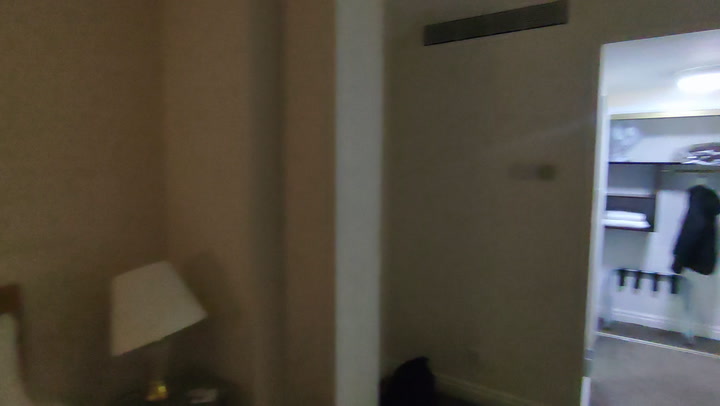
Where is `golden lamp`? golden lamp is located at coordinates (160, 381).